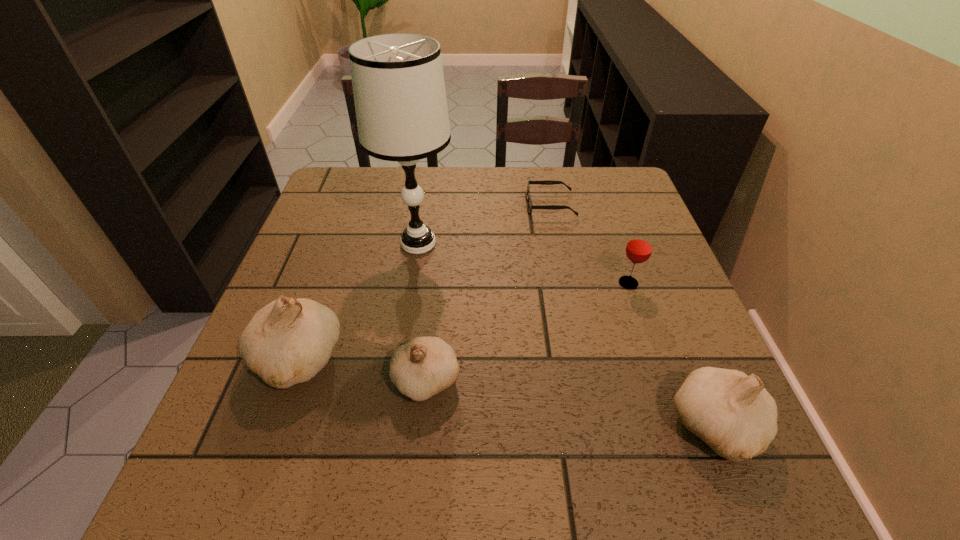
Identify the location of the leftmost object. (287, 342).

This screenshot has width=960, height=540. Identify the location of the shortest garlic. click(424, 366).

Where is `the second shortest object`? The width and height of the screenshot is (960, 540). the second shortest object is located at coordinates click(x=424, y=366).

I want to click on the second tallest garlic, so click(x=733, y=413).

I want to click on the farthest object, so tap(546, 182).

Find the location of a particular element. the third object from right to left is located at coordinates point(546,182).

The width and height of the screenshot is (960, 540). I want to click on the fifth nearest object, so click(x=398, y=84).

Locate an element on the screen. The height and width of the screenshot is (540, 960). the tallest object is located at coordinates (398, 84).

Where is `glass`? The height and width of the screenshot is (540, 960). glass is located at coordinates (639, 247).

At what (x,y) coordinates should I click in order to perform the action: click on blank space located on the right of the leftmost garlic. Please return your answer as a coordinate pair (x, y). The width and height of the screenshot is (960, 540). Looking at the image, I should click on (540, 360).